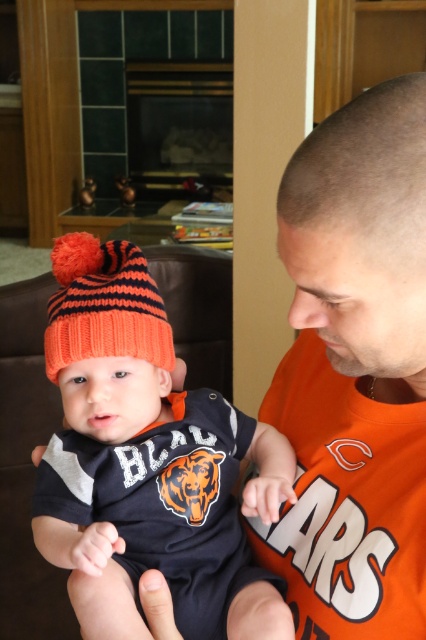
Between knitted wool beanie at center-left and orange knitted beanie at center, which one is positioned lower?

knitted wool beanie at center-left is lower down.

Is knitted wool beanie at center-left thinner than orange knitted beanie at center?

No.

Who is more distant from viewer, (114, 616) or (60, 262)?

Point (60, 262)

What are the coordinates of `knitted wool beanie at center-left` in the screenshot? It's located at [x=108, y=340].

Is knitted wool beanie at center-left further to camera compared to orange jersey at center?

Yes, it is.

Can you confirm if knitted wool beanie at center-left is wider than orange jersey at center?

Yes, knitted wool beanie at center-left is wider than orange jersey at center.

Which is in front, point (261, 458) or point (360, 428)?

Point (360, 428) is in front.

Locate an element on the screen. This screenshot has width=426, height=640. knitted wool beanie at center-left is located at coordinates (108, 340).

Does orange jersey at center appear under orange knitted beanie at center?

Indeed, orange jersey at center is positioned under orange knitted beanie at center.

Between orange jersey at center and orange knitted beanie at center, which one is positioned higher?

orange knitted beanie at center is higher up.

Who is more distant from viewer, (368, 518) or (83, 234)?

Point (83, 234)

I want to click on orange jersey at center, so click(347, 502).